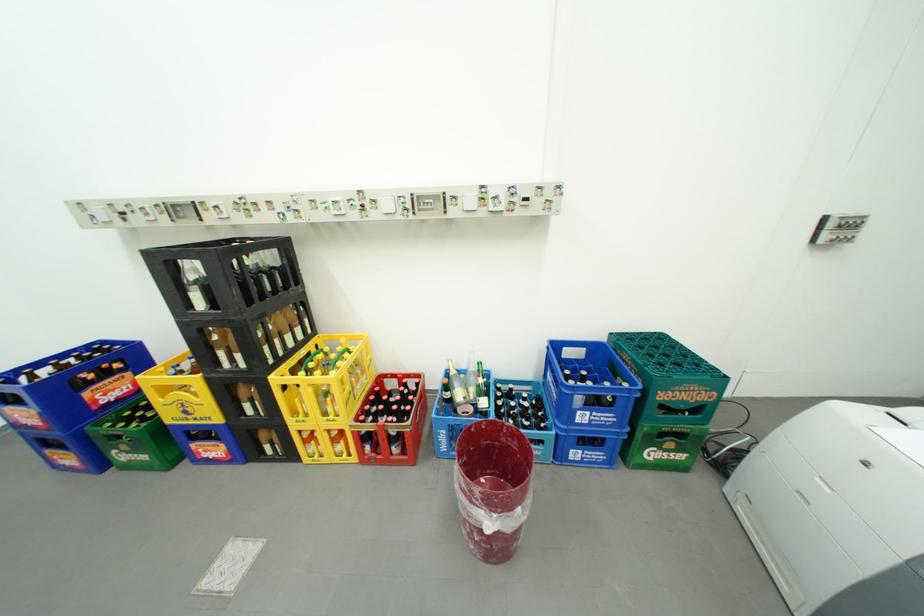
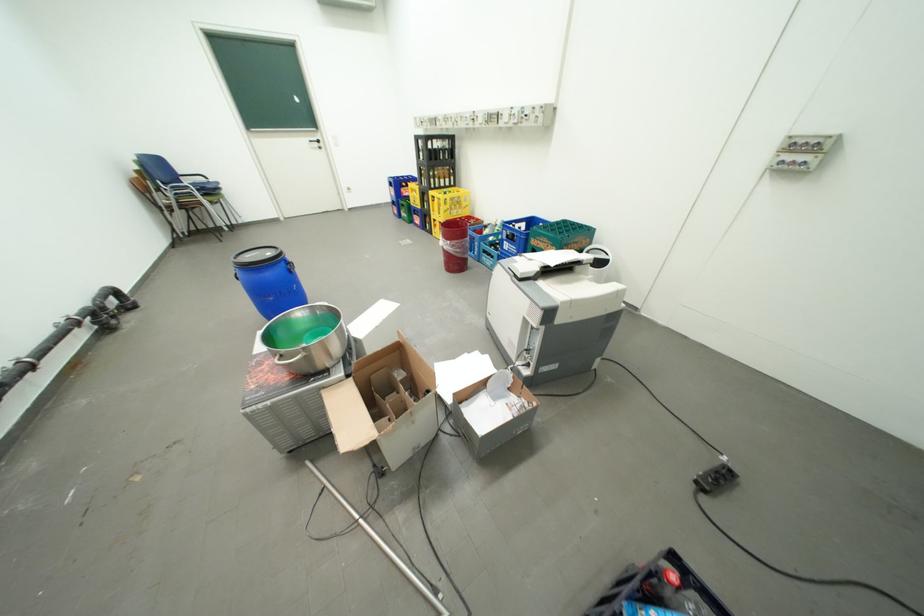
The point at (362, 395) is marked in the first image. Where is the corresponding point in the second image?

(459, 212)